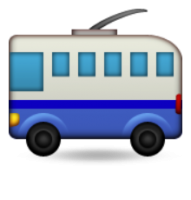
This screenshot has width=191, height=200. Identify the location of window. (90, 69).